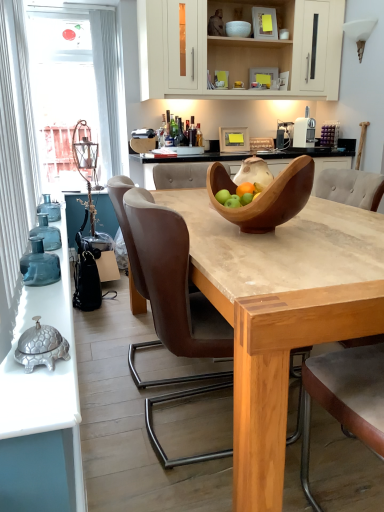
Question: In terms of height, does wooden bowl at center, which is the 1th bowl in front-to-back order, look taller or shorter compared to light brown leather armchair at center?

Choices:
 (A) short
 (B) tall

Answer: (A)

Question: Is point (271, 183) positioned closer to the camera than point (352, 177)?

Choices:
 (A) closer
 (B) farther

Answer: (A)

Question: Which of these objects is positioned closest to the light brown leather armchair at center?

Choices:
 (A) transparent glass window at upper left
 (B) wooden bowl at center, the 1th bowl positioned from the bottom
 (C) white glossy bowl at upper center, acting as the 1th bowl starting from the top
 (D) white matte cabinet at upper center
 (E) brown leather chair at center

Answer: (B)

Question: Which of these objects is positioned farthest from the translucent glass bottles at left?

Choices:
 (A) light brown leather armchair at center
 (B) white matte cabinet at upper center
 (C) brown leather chair at center
 (D) white glossy bowl at upper center, the 2th bowl in the front-to-back sequence
 (E) transparent glass window at upper left

Answer: (D)